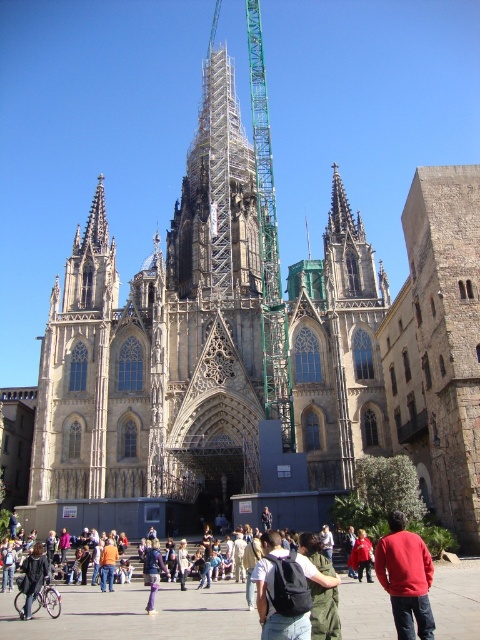
Question: Which object appears closest to the camera in this image?

Choices:
 (A) dark green backpack at center
 (B) red cotton sweater at center

Answer: (A)

Question: Is dark green backpack at center thinner than red cotton sweater at center?

Choices:
 (A) no
 (B) yes

Answer: (B)

Question: Where is dark green backpack at center located in relation to red cotton sweater at center in the image?

Choices:
 (A) right
 (B) left

Answer: (B)

Question: Is red cotton sweater at center to the left of denim jacket at lower left from the viewer's perspective?

Choices:
 (A) yes
 (B) no

Answer: (B)

Question: Which point is farther from the camera taking this photo?

Choices:
 (A) (418, 552)
 (B) (291, 561)

Answer: (A)

Question: Which object is farther from the camera taking this photo?

Choices:
 (A) red cotton sweater at center
 (B) red cotton shirt at center
 (C) denim jacket at lower left

Answer: (B)